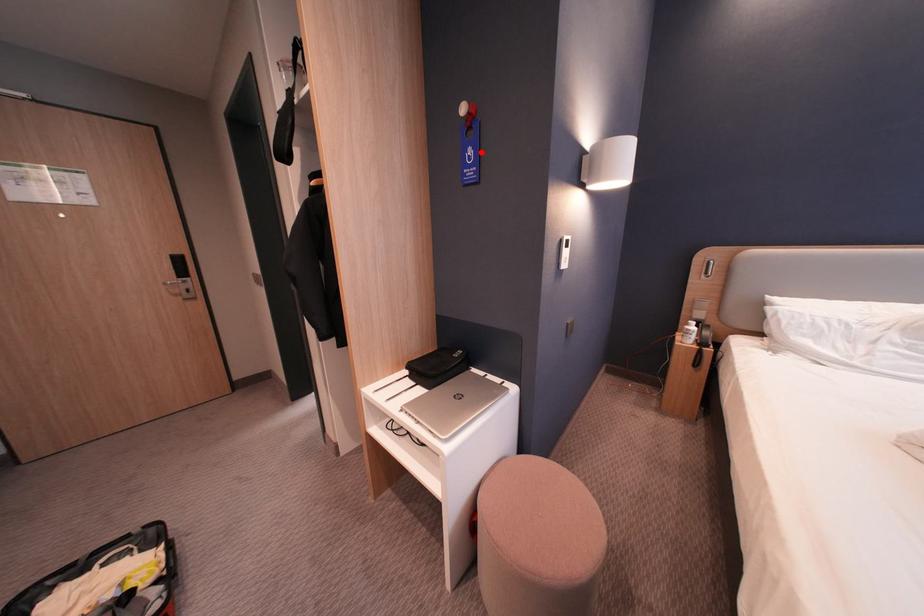
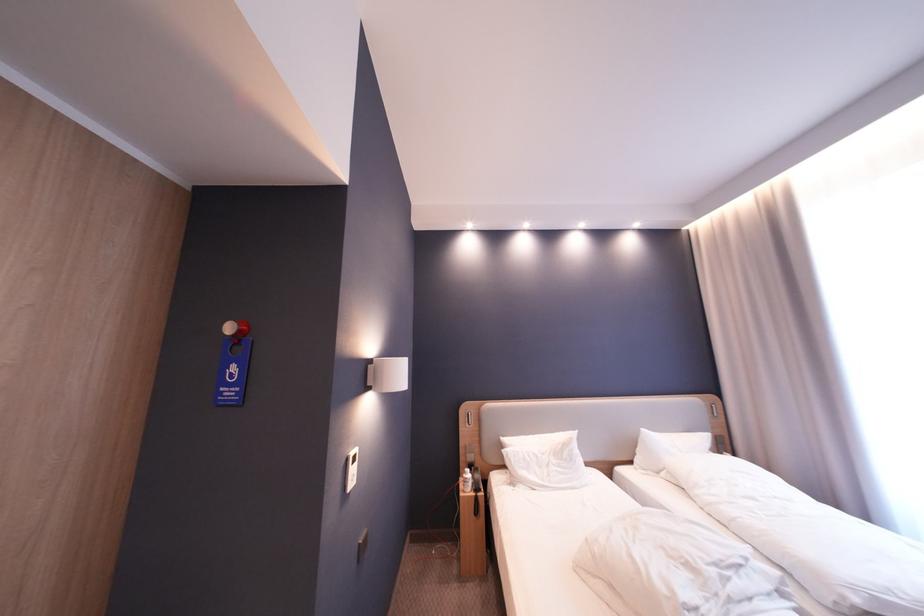
Question: I am providing you with two images of the same scene from different viewpoints. A red point is marked on the first image. At the location where the point appears in image 1, is it still visible in image 2?

Choices:
 (A) Yes
 (B) No

Answer: (A)